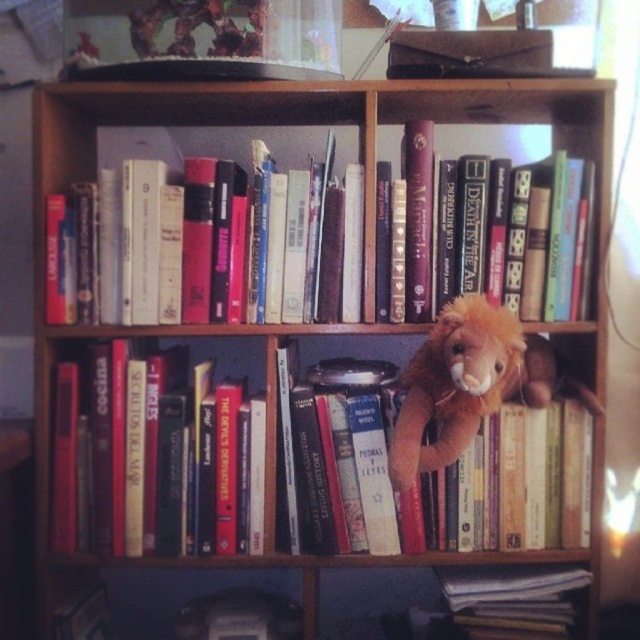
Question: Does hardcover books at center appear over hardcover book at center?

Choices:
 (A) no
 (B) yes

Answer: (A)

Question: Which point is closer to the camera?

Choices:
 (A) (161, 499)
 (B) (227, 150)
 (C) (468, 397)
 (D) (392, 401)

Answer: (C)

Question: Which object is closer to the camera taking this photo?

Choices:
 (A) hardcover book at center
 (B) hardcover books at left
 (C) brown plush toy at center-right

Answer: (C)

Question: Based on their relative distances, which object is farther from the brown plush toy at center-right?

Choices:
 (A) hardcover books at left
 (B) hardcover books at center
 (C) soft brown plush toy at center
 (D) hardcover book at lower right

Answer: (B)

Question: Is soft brown plush toy at center below hardcover books at center?

Choices:
 (A) no
 (B) yes

Answer: (B)

Question: Can you confirm if soft brown plush toy at center is wider than hardcover book at lower right?

Choices:
 (A) yes
 (B) no

Answer: (A)